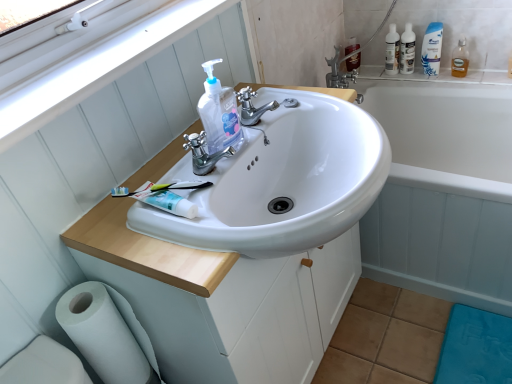
At what (x,y) coordinates should I click in order to perform the action: click on vacant space in front of clear plastic bottles at upper right, the second mouthwash positioned from the right. Please return your answer as a coordinate pair (x, y). The image size is (512, 384). Looking at the image, I should click on (424, 73).